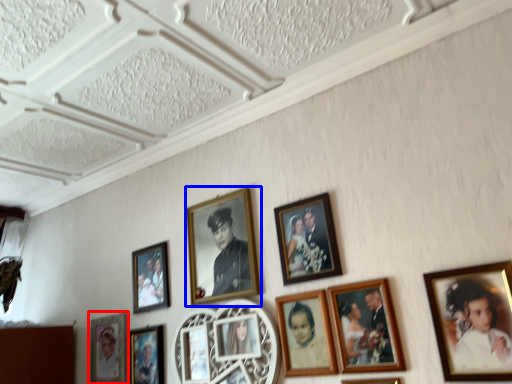
Question: Which object is closer to the camera taking this photo, picture frame (highlighted by a red box) or picture frame (highlighted by a blue box)?

Choices:
 (A) picture frame
 (B) picture frame

Answer: (B)